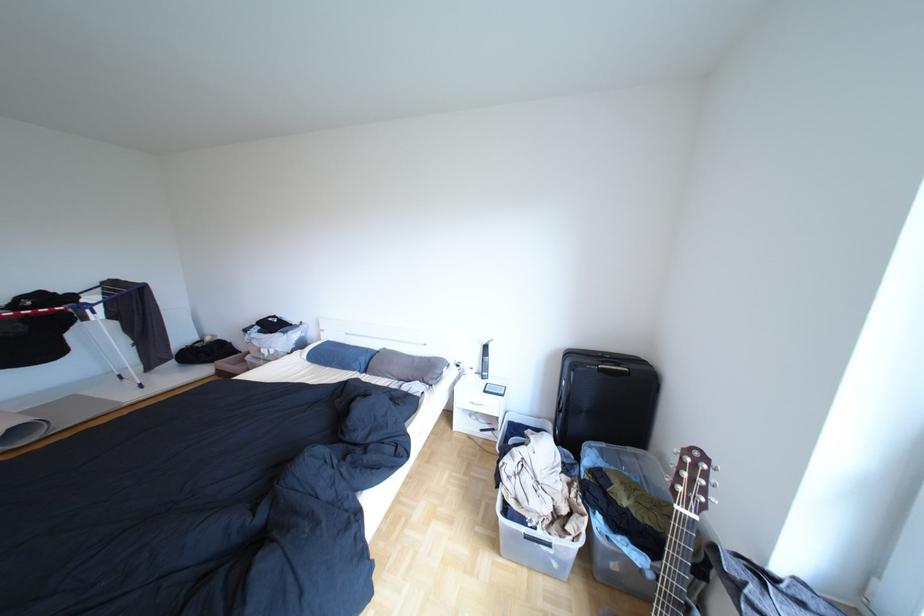
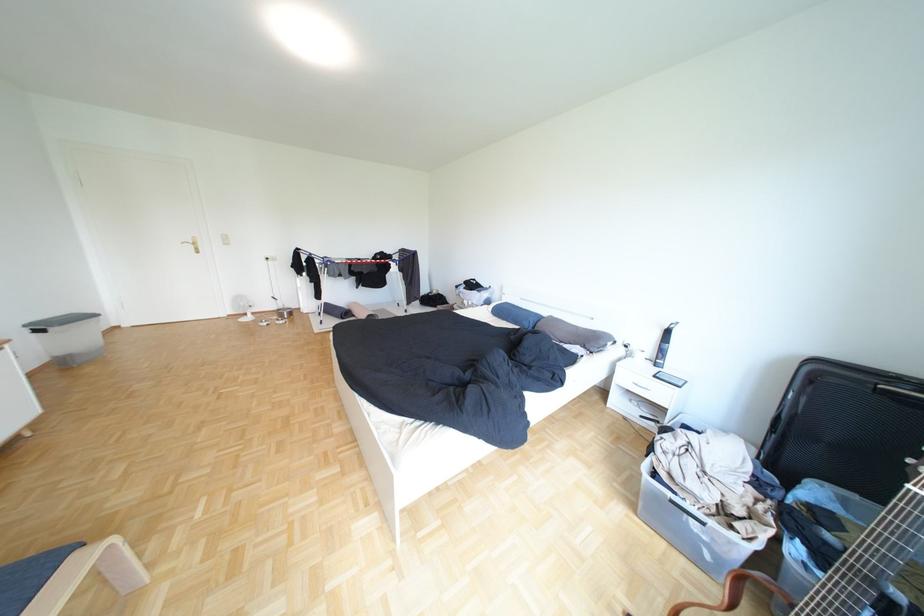
The point at (439, 382) is marked in the first image. Where is the corresponding point in the second image?

(600, 347)